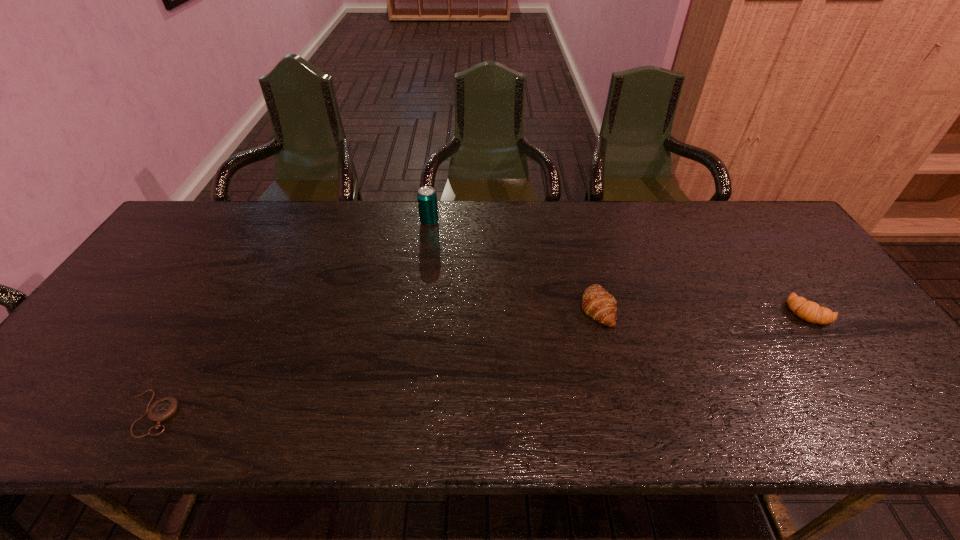
Find the location of a particular element. the closest object to the shortest object is located at coordinates (427, 198).

Image resolution: width=960 pixels, height=540 pixels. In order to click on free point that satisfies the following two spatial constraints: 1. on the front side of the taller crescent roll; 2. on the left side of the farthest object in this screenshot , I will do [418, 307].